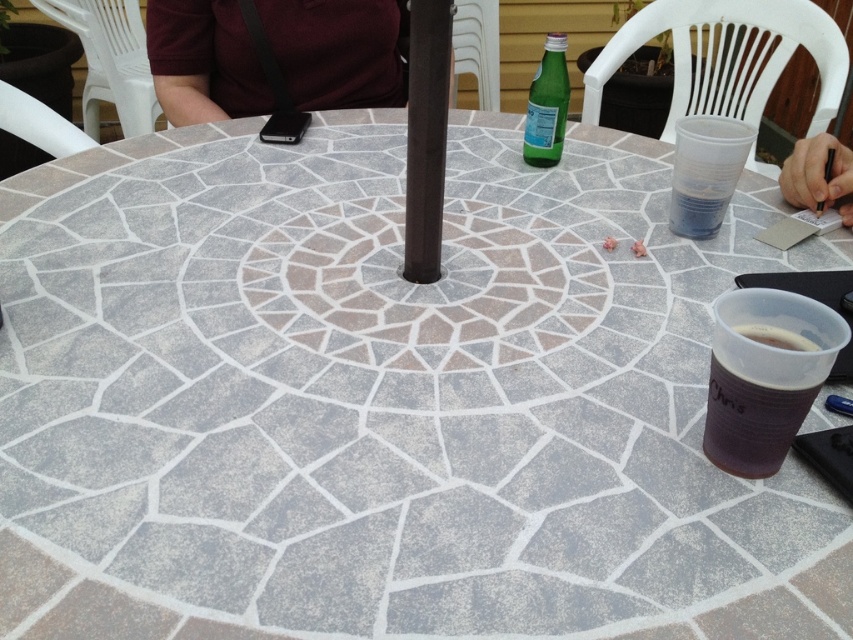
Question: Which of the following is the closest to the observer?

Choices:
 (A) (540, 109)
 (B) (814, 208)
 (C) (714, 400)

Answer: (C)

Question: Is black paper cup at lower right bigger than green glass bottle at upper center?

Choices:
 (A) yes
 (B) no

Answer: (B)

Question: Which object is farther from the camera taking this photo?

Choices:
 (A) black paper cup at lower right
 (B) green glass bottle at upper center

Answer: (B)

Question: Is the position of dark red fabric at upper center more distant than that of green glass bottle at upper center?

Choices:
 (A) yes
 (B) no

Answer: (A)

Question: Among these points, which one is nearest to the camera?

Choices:
 (A) (813, 188)
 (B) (728, 394)

Answer: (B)

Question: Is dark red fabric at upper center bigger than black matte pole at center?

Choices:
 (A) no
 (B) yes

Answer: (B)